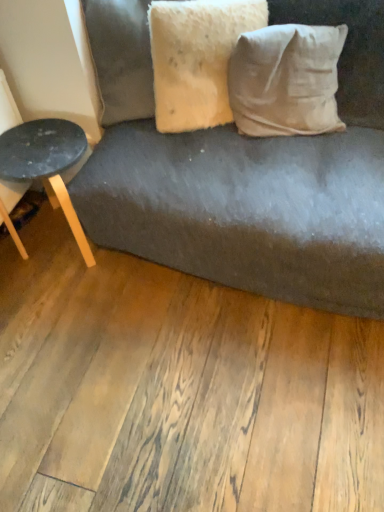
Question: Considering the relative sizes of white cotton pillow at upper right, which ranks as the 1th pillow in right-to-left order, and fuzzy beige pillow at upper center, the first pillow from the left, in the image provided, is white cotton pillow at upper right, which ranks as the 1th pillow in right-to-left order, taller than fuzzy beige pillow at upper center, the first pillow from the left,?

Choices:
 (A) no
 (B) yes

Answer: (A)

Question: Is white cotton pillow at upper right, which ranks as the 1th pillow in right-to-left order, in contact with fuzzy beige pillow at upper center, the first pillow from the left?

Choices:
 (A) no
 (B) yes

Answer: (A)

Question: Is white cotton pillow at upper right, the 2th pillow when ordered from left to right, to the right of fuzzy beige pillow at upper center, the first pillow from the left, from the viewer's perspective?

Choices:
 (A) yes
 (B) no

Answer: (A)

Question: Does white cotton pillow at upper right, which ranks as the 1th pillow in right-to-left order, turn towards fuzzy beige pillow at upper center, the first pillow from the left?

Choices:
 (A) no
 (B) yes

Answer: (A)

Question: Considering the relative sizes of white cotton pillow at upper right, which ranks as the 1th pillow in right-to-left order, and fuzzy beige pillow at upper center, the first pillow from the left, in the image provided, is white cotton pillow at upper right, which ranks as the 1th pillow in right-to-left order, bigger than fuzzy beige pillow at upper center, the first pillow from the left,?

Choices:
 (A) yes
 (B) no

Answer: (B)

Question: Based on their sizes in the image, would you say white cotton pillow at upper right, the 2th pillow when ordered from left to right, is bigger or smaller than fuzzy beige pillow at upper center, the first pillow from the left?

Choices:
 (A) small
 (B) big

Answer: (A)

Question: Looking at their shapes, would you say white cotton pillow at upper right, the 2th pillow when ordered from left to right, is wider or thinner than fuzzy beige pillow at upper center, the first pillow from the left?

Choices:
 (A) wide
 (B) thin

Answer: (A)

Question: Considering their positions, is white cotton pillow at upper right, which ranks as the 1th pillow in right-to-left order, located in front of or behind fuzzy beige pillow at upper center, the first pillow from the left?

Choices:
 (A) behind
 (B) front

Answer: (A)

Question: Considering the positions of white cotton pillow at upper right, the 2th pillow when ordered from left to right, and fuzzy beige pillow at upper center, placed as the second pillow when sorted from right to left, in the image, is white cotton pillow at upper right, the 2th pillow when ordered from left to right, taller or shorter than fuzzy beige pillow at upper center, placed as the second pillow when sorted from right to left,?

Choices:
 (A) tall
 (B) short

Answer: (B)

Question: From the image's perspective, is matte black stool at left located above or below white cotton pillow at upper right, which ranks as the 1th pillow in right-to-left order?

Choices:
 (A) below
 (B) above

Answer: (A)

Question: Considering their positions, is matte black stool at left located in front of or behind white cotton pillow at upper right, the 2th pillow when ordered from left to right?

Choices:
 (A) behind
 (B) front

Answer: (A)

Question: Would you say matte black stool at left is to the left or to the right of white cotton pillow at upper right, the 2th pillow when ordered from left to right, in the picture?

Choices:
 (A) right
 (B) left

Answer: (B)

Question: Looking at the image, does matte black stool at left seem bigger or smaller compared to white cotton pillow at upper right, which ranks as the 1th pillow in right-to-left order?

Choices:
 (A) small
 (B) big

Answer: (B)

Question: From a real-world perspective, is fuzzy beige pillow at upper center, the first pillow from the left, above or below white cotton pillow at upper right, which ranks as the 1th pillow in right-to-left order?

Choices:
 (A) below
 (B) above

Answer: (B)

Question: Considering the positions of fuzzy beige pillow at upper center, the first pillow from the left, and white cotton pillow at upper right, which ranks as the 1th pillow in right-to-left order, in the image, is fuzzy beige pillow at upper center, the first pillow from the left, wider or thinner than white cotton pillow at upper right, which ranks as the 1th pillow in right-to-left order,?

Choices:
 (A) wide
 (B) thin

Answer: (B)